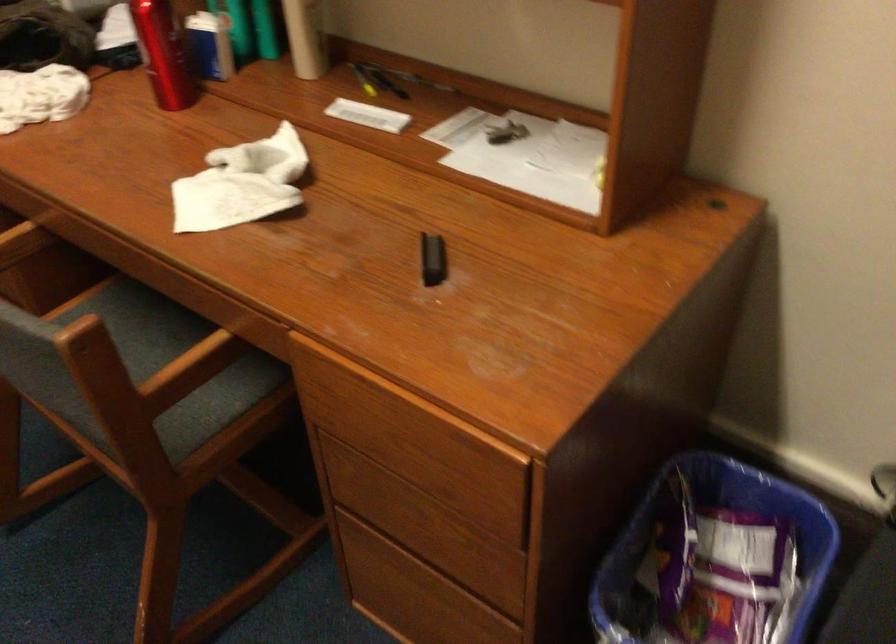
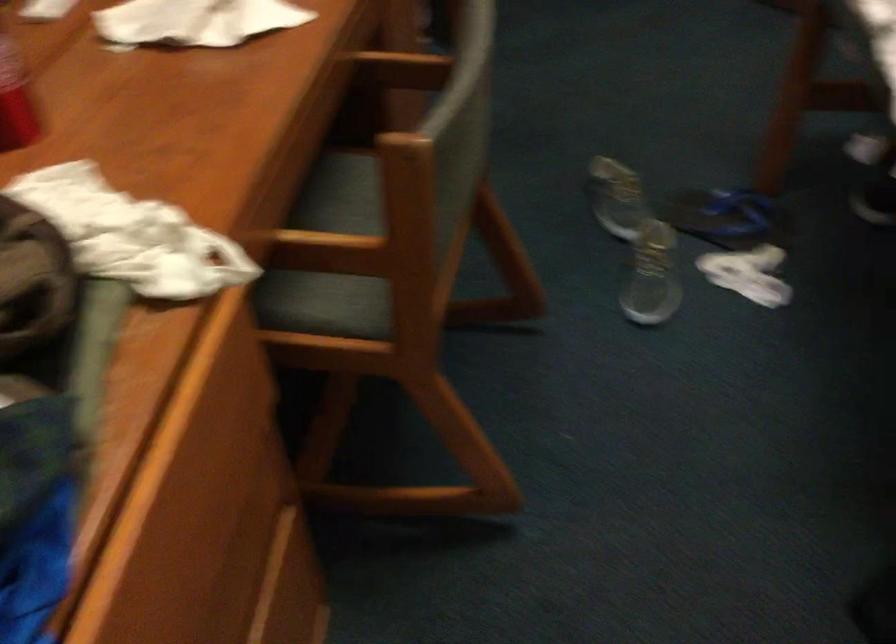
In the second image, find the point that corresponds to [190,371] in the first image.

(401, 69)